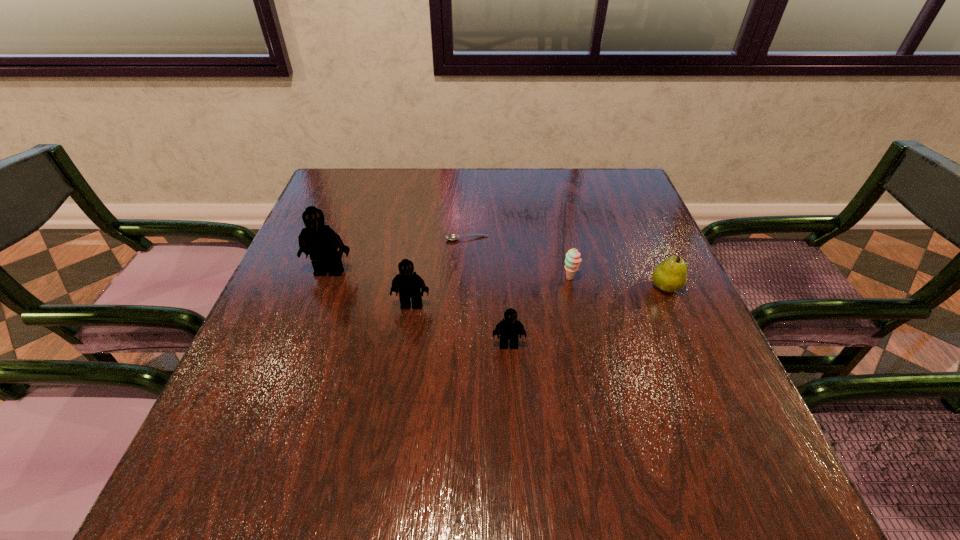
This screenshot has width=960, height=540. Identify the location of vacant place for an extra Lego on the right. (625, 393).